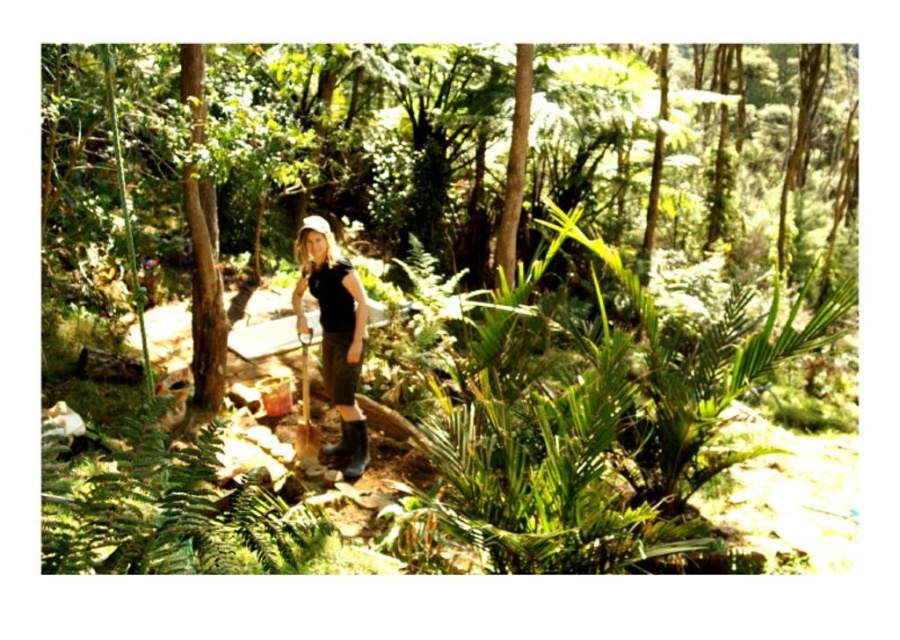
Question: Which point appears closest to the camera in this image?

Choices:
 (A) (192, 173)
 (B) (349, 444)

Answer: (A)

Question: Does green leafy fern at center have a greater width compared to smooth brown tree trunk at left?

Choices:
 (A) no
 (B) yes

Answer: (B)

Question: Which object is positioned farthest from the green leafy fern at center?

Choices:
 (A) smooth brown tree trunk at left
 (B) matte black shirt at center

Answer: (A)

Question: Which point is farther to the camera?

Choices:
 (A) (212, 288)
 (B) (590, 428)

Answer: (A)

Question: From the image, what is the correct spatial relationship of matte black shirt at center in relation to smooth brown tree trunk at left?

Choices:
 (A) right
 (B) left

Answer: (A)

Question: Can you confirm if green leafy fern at center is positioned to the left of smooth brown tree trunk at left?

Choices:
 (A) yes
 (B) no

Answer: (B)